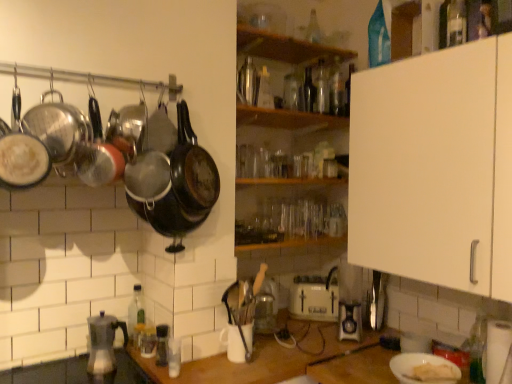
What is the approximate height of white matte cabinet at upper right?

white matte cabinet at upper right is 31.87 inches in height.

Image resolution: width=512 pixels, height=384 pixels. I want to click on transparent glass bottle at upper center, which ranks as the third bottle in back-to-front order, so click(336, 92).

Measure the distance between white plastic toaster at center, marked as the 6th appliance in a front-to-back arrangement, and camera.

white plastic toaster at center, marked as the 6th appliance in a front-to-back arrangement, and camera are 1.96 meters apart.

What are the coordinates of `white plastic toaster at center, the 4th appliance in the left-to-right sequence` in the screenshot? It's located at (315, 297).

Where is `matte black frying pan at left`? matte black frying pan at left is located at coordinates (21, 153).

Considering the sizes of objects transparent glass bottle at center, the 5th bottle positioned from the right, and transparent glass bottle at upper center, arranged as the seventh bottle when viewed from the left, in the image provided, who is bigger, transparent glass bottle at center, the 5th bottle positioned from the right, or transparent glass bottle at upper center, arranged as the seventh bottle when viewed from the left,?

transparent glass bottle at center, the 5th bottle positioned from the right.

Is transparent glass bottle at center, the 5th bottle in the left-to-right sequence, facing away from transparent glass bottle at upper center, marked as the 7th bottle in a front-to-back arrangement?

That's not correct — transparent glass bottle at center, the 5th bottle in the left-to-right sequence, is not looking away from transparent glass bottle at upper center, marked as the 7th bottle in a front-to-back arrangement.

Based on the photo, how much distance is there between transparent glass bottle at center, the fourth bottle when ordered from back to front, and transparent glass bottle at upper center, marked as the 7th bottle in a front-to-back arrangement?

transparent glass bottle at center, the fourth bottle when ordered from back to front, is 2.16 inches from transparent glass bottle at upper center, marked as the 7th bottle in a front-to-back arrangement.

Based on the photo, considering the relative sizes of transparent glass bottle at center, the 5th bottle positioned from the right, and transparent glass bottle at upper center, which ranks as the third bottle in back-to-front order, in the image provided, is transparent glass bottle at center, the 5th bottle positioned from the right, wider than transparent glass bottle at upper center, which ranks as the third bottle in back-to-front order,?

Correct, the width of transparent glass bottle at center, the 5th bottle positioned from the right, exceeds that of transparent glass bottle at upper center, which ranks as the third bottle in back-to-front order.

Is there a large distance between green glass bottle at lower left, which is the 8th bottle from back to front, and shiny silver wok at left, the sixth wok in the right-to-left sequence?

They are positioned close to each other.

Is green glass bottle at lower left, which is the second bottle in front-to-back order, inside the boundaries of shiny silver wok at left, the sixth wok in the right-to-left sequence, or outside?

green glass bottle at lower left, which is the second bottle in front-to-back order, cannot be found inside shiny silver wok at left, the sixth wok in the right-to-left sequence.

In the image, is green glass bottle at lower left, the ninth bottle when ordered from right to left, on the left side or the right side of shiny silver wok at left, the sixth wok in the right-to-left sequence?

Based on their positions, green glass bottle at lower left, the ninth bottle when ordered from right to left, is located to the right of shiny silver wok at left, the sixth wok in the right-to-left sequence.

From a real-world perspective, which is physically above, green glass bottle at lower left, which is the 8th bottle from back to front, or shiny silver wok at left, the first wok positioned from the left?

In real-world perspective, shiny silver wok at left, the first wok positioned from the left, is above.

Which appliance is the 1st one when counting from the back of the shiny silver wok at left, the sixth wok in the right-to-left sequence? Please provide its 2D coordinates.

[(423, 369)]

In terms of height, does white matte plate at lower right, the 1th appliance when ordered from front to back, look taller or shorter compared to shiny silver wok at left, the sixth wok in the right-to-left sequence?

Considering their sizes, white matte plate at lower right, the 1th appliance when ordered from front to back, has less height than shiny silver wok at left, the sixth wok in the right-to-left sequence.

From the image's perspective, which is below, white matte plate at lower right, the 2th appliance from the right, or shiny silver wok at left, the sixth wok in the right-to-left sequence?

white matte plate at lower right, the 2th appliance from the right, from the image's perspective.

Based on the photo, who is smaller, white matte plate at lower right, the 1th appliance when ordered from front to back, or shiny silver wok at left, the sixth wok in the right-to-left sequence?

With smaller size is white matte plate at lower right, the 1th appliance when ordered from front to back.

Between translucent glass jar at lower center, which is the 4th appliance in front-to-back order, and wooden shelf at center, the first shelf ordered from the bottom, which one has larger size?

wooden shelf at center, the first shelf ordered from the bottom.

Can you tell me how much translucent glass jar at lower center, which ranks as the third appliance in back-to-front order, and wooden shelf at center, the 2th shelf viewed from the top, differ in facing direction?

The angle between the facing direction of translucent glass jar at lower center, which ranks as the third appliance in back-to-front order, and the facing direction of wooden shelf at center, the 2th shelf viewed from the top, is 87.6 degrees.

Is translucent glass jar at lower center, acting as the 5th appliance starting from the right, completely or partially outside of wooden shelf at center, the 2th shelf viewed from the top?

translucent glass jar at lower center, acting as the 5th appliance starting from the right, is positioned outside wooden shelf at center, the 2th shelf viewed from the top.

From the picture: Does translucent glass jar at lower center, acting as the second appliance starting from the left, have a lesser height compared to wooden shelf at center, the 2th shelf viewed from the top?

In fact, translucent glass jar at lower center, acting as the second appliance starting from the left, may be taller than wooden shelf at center, the 2th shelf viewed from the top.

Relative to black matte wok at center, arranged as the fifth wok when viewed from the left, is black matte wok at upper center, acting as the third wok starting from the left, in front or behind?

black matte wok at upper center, acting as the third wok starting from the left, is positioned closer to the viewer than black matte wok at center, arranged as the fifth wok when viewed from the left.

How far apart are black matte wok at upper center, the fourth wok when ordered from right to left, and black matte wok at center, arranged as the fifth wok when viewed from the left?

black matte wok at upper center, the fourth wok when ordered from right to left, and black matte wok at center, arranged as the fifth wok when viewed from the left, are 2.53 inches apart.

From a real-world perspective, does black matte wok at upper center, acting as the third wok starting from the left, stand above black matte wok at center, arranged as the fifth wok when viewed from the left?

Yes.

Who is taller, black matte wok at upper center, the fourth wok when ordered from right to left, or black matte wok at center, which is the 2th wok from right to left?

Standing taller between the two is black matte wok at center, which is the 2th wok from right to left.

Is transparent glass bottle at upper center, which appears as the first bottle when viewed from the back, facing away from translucent glass bottle at upper center, which is the 4th bottle from left to right?

No.

Looking at their sizes, would you say transparent glass bottle at upper center, marked as the ninth bottle in a front-to-back arrangement, is wider or thinner than translucent glass bottle at upper center, which is the fifth bottle in front-to-back order?

In the image, transparent glass bottle at upper center, marked as the ninth bottle in a front-to-back arrangement, appears to be more narrow than translucent glass bottle at upper center, which is the fifth bottle in front-to-back order.

Relative to translucent glass bottle at upper center, which is the fifth bottle in front-to-back order, is transparent glass bottle at upper center, which is counted as the 6th bottle, starting from the left, in front or behind?

Visually, transparent glass bottle at upper center, which is counted as the 6th bottle, starting from the left, is located behind translucent glass bottle at upper center, which is the fifth bottle in front-to-back order.

Which point is more distant from viewer, (311, 42) or (306, 83)?

The point (306, 83) is behind.

Consider the image. Does shiny silver wok at left, the first wok positioned from the left, have a larger size compared to wooden shelf at center, the 2th shelf viewed from the top?

Incorrect, shiny silver wok at left, the first wok positioned from the left, is not larger than wooden shelf at center, the 2th shelf viewed from the top.

Identify the location of the 6th wok counting from the left side of the wooden shelf at center, the 2th shelf viewed from the top. (59, 128).

From the image's perspective, between shiny silver wok at left, the sixth wok in the right-to-left sequence, and wooden shelf at center, the first shelf ordered from the bottom, which one is located above?

wooden shelf at center, the first shelf ordered from the bottom.

Which of these two, shiny silver wok at left, the first wok positioned from the left, or wooden shelf at center, the 2th shelf viewed from the top, is wider?

Wider between the two is wooden shelf at center, the 2th shelf viewed from the top.

From a real-world perspective, which bottle is the 1st one above the transparent glass bottle at center, the 5th bottle positioned from the right? Please provide its 2D coordinates.

[(336, 92)]

Which bottle is the 2nd one when counting from the back of the shiny silver wok at left, the sixth wok in the right-to-left sequence? Please provide its 2D coordinates.

[(135, 310)]

Based on their spatial positions, is matte black coffee maker at lower left, acting as the 6th appliance starting from the right, or green glass bottle at lower left, the ninth bottle when ordered from right to left, closer to black matte wok at center, arranged as the fifth wok when viewed from the left?

green glass bottle at lower left, the ninth bottle when ordered from right to left, is positioned closer to the anchor black matte wok at center, arranged as the fifth wok when viewed from the left.

Looking at the image, which one is located closer to metallic glass bottle at upper center, which is the third bottle from front to back, black matte wok at center, which is the 2th wok from right to left, or wooden shelf at center, the first shelf ordered from the bottom?

The object closer to metallic glass bottle at upper center, which is the third bottle from front to back, is wooden shelf at center, the first shelf ordered from the bottom.

When comparing their distances from black matte wok at upper left, which is counted as the third wok, starting from the right, does transparent glass bottle at upper right, which is the ninth bottle from left to right, or white matte cabinet at upper right seem further?

transparent glass bottle at upper right, which is the ninth bottle from left to right, is positioned further to the anchor black matte wok at upper left, which is counted as the third wok, starting from the right.

When comparing their distances from transparent glass bottle at upper center, the 8th bottle positioned from the left, does metallic glass bottle at upper center, which is the third bottle from front to back, or white plastic toaster at center, marked as the 6th appliance in a front-to-back arrangement, seem closer?

metallic glass bottle at upper center, which is the third bottle from front to back, is positioned closer to the anchor transparent glass bottle at upper center, the 8th bottle positioned from the left.

Estimate the real-world distances between objects in this image. Which object is closer to green glass bottle at lower left, which is the second bottle in front-to-back order, wooden shelf at upper center, positioned as the second shelf in bottom-to-top order, or transparent glass bottle at upper center, which is the second bottle from back to front?

The object closer to green glass bottle at lower left, which is the second bottle in front-to-back order, is wooden shelf at upper center, positioned as the second shelf in bottom-to-top order.

Considering their positions, is white matte cabinet at upper right positioned closer to green glass bottle at lower left, placed as the first bottle when sorted from left to right, than shiny silver wok at left, the first wok positioned from the left?

Among the two, shiny silver wok at left, the first wok positioned from the left, is located nearer to green glass bottle at lower left, placed as the first bottle when sorted from left to right.

Considering their positions, is wooden shelf at upper center, marked as the first shelf in a top-to-bottom arrangement, positioned closer to shiny black wok at left, the fifth wok in the right-to-left sequence, than transparent glass bottle at upper center, arranged as the seventh bottle when viewed from the left?

wooden shelf at upper center, marked as the first shelf in a top-to-bottom arrangement, is closer to shiny black wok at left, the fifth wok in the right-to-left sequence.

Looking at this image, estimate the real-world distances between objects in this image. Which object is closer to translucent glass bottle at upper center, marked as the sixth bottle in a right-to-left arrangement, translucent glass jar at lower center, acting as the second appliance starting from the left, or wooden shelf at upper center, marked as the first shelf in a top-to-bottom arrangement?

The object closer to translucent glass bottle at upper center, marked as the sixth bottle in a right-to-left arrangement, is wooden shelf at upper center, marked as the first shelf in a top-to-bottom arrangement.

This screenshot has height=384, width=512. In order to click on bottle that lies between matte black frying pan at left and white matte counter top at center from top to bottom in this screenshot , I will do `click(135, 310)`.

What are the coordinates of `cabinetry that lies between transparent glass bottle at center, the 5th bottle in the left-to-right sequence, and black plastic pepper grinder at lower left, placed as the 4th appliance when sorted from back to front, from top to bottom` in the screenshot? It's located at (435, 168).

Image resolution: width=512 pixels, height=384 pixels. Find the location of `bottle between black matte wok at upper center, acting as the third wok starting from the left, and translucent glass jar at lower center, acting as the 5th appliance starting from the right, in the vertical direction`. bottle between black matte wok at upper center, acting as the third wok starting from the left, and translucent glass jar at lower center, acting as the 5th appliance starting from the right, in the vertical direction is located at coordinates (135, 310).

Image resolution: width=512 pixels, height=384 pixels. I want to click on bottle between translucent glass bottle at upper center, which is the 4th bottle from left to right, and green glass bottle at lower left, placed as the first bottle when sorted from left to right, in the up-down direction, so click(293, 91).